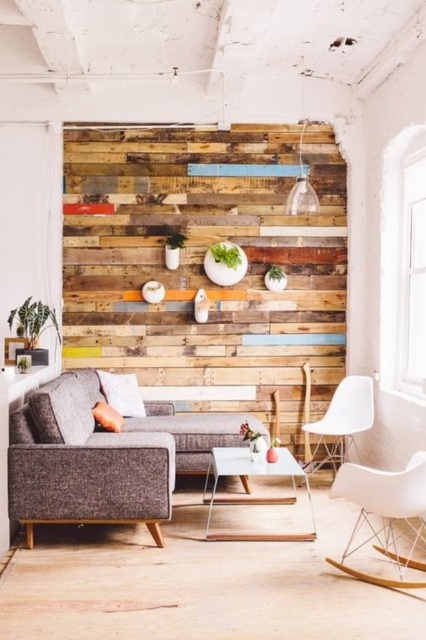
Question: Can you confirm if wooden planks at center is positioned to the right of white matte rocking chair at lower right?

Choices:
 (A) no
 (B) yes

Answer: (A)

Question: Which of these objects is positioned farthest from the white glass coffee table at center?

Choices:
 (A) white matte rocking chair at lower right
 (B) wooden planks at center

Answer: (B)

Question: Is white glass coffee table at center thinner than white plastic chair at right?

Choices:
 (A) yes
 (B) no

Answer: (B)

Question: Which point is closer to the camera?

Choices:
 (A) (236, 449)
 (B) (155, 490)

Answer: (B)

Question: Which point is farther from the camera taking this photo?

Choices:
 (A) (279, 476)
 (B) (302, 346)

Answer: (B)

Question: Observing the image, what is the correct spatial positioning of wooden planks at center in reference to white matte rocking chair at lower right?

Choices:
 (A) above
 (B) below

Answer: (A)